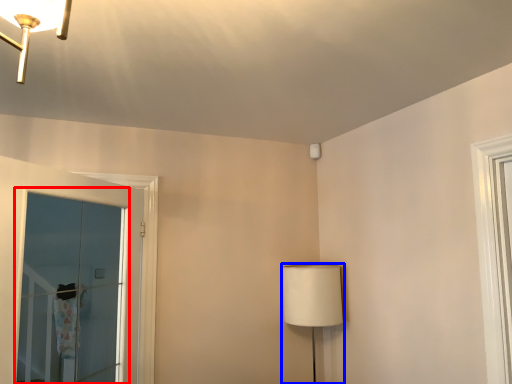
Question: Among these objects, which one is nearest to the camera, window (highlighted by a red box) or table lamp (highlighted by a blue box)?

Choices:
 (A) window
 (B) table lamp

Answer: (A)